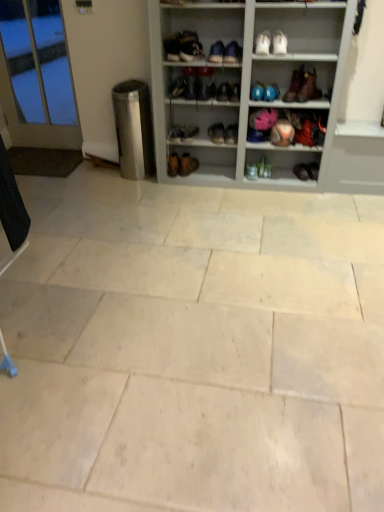
In order to click on vacant space to the left of matte black shoe at center, acting as the first footwear starting from the right in this screenshot , I will do `click(289, 177)`.